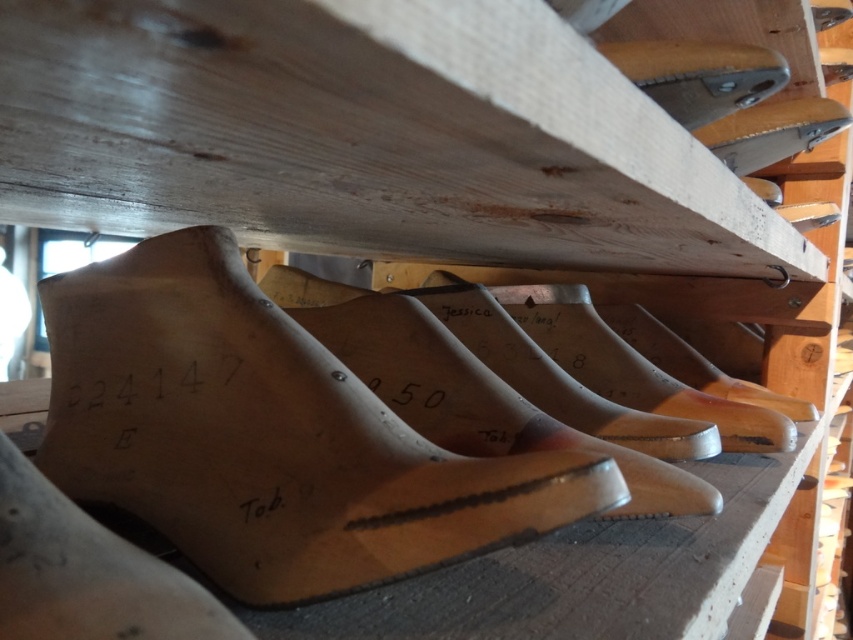
Who is more forward, (123,572) or (811,109)?

Point (123,572) is more forward.

Image resolution: width=853 pixels, height=640 pixels. What do you see at coordinates (86, 572) in the screenshot?
I see `light brown wood shoe at lower left` at bounding box center [86, 572].

Locate an element on the screen. Image resolution: width=853 pixels, height=640 pixels. light brown wood shoe at lower left is located at coordinates (86, 572).

Who is higher up, light brown wood shoe at lower left or wooden shoe at upper center?

wooden shoe at upper center

Who is positioned more to the right, light brown wood shoe at lower left or wooden shoe at upper center?

Positioned to the right is wooden shoe at upper center.

Is point (131, 616) farther from camera compared to point (659, 92)?

No, it is in front of (659, 92).

Locate an element on the screen. light brown wood shoe at lower left is located at coordinates (86, 572).

Who is taller, natural wood shoe at center or wooden shoe at upper right?

natural wood shoe at center

Does natural wood shoe at center have a greater height compared to wooden shoe at upper right?

Indeed, natural wood shoe at center has a greater height compared to wooden shoe at upper right.

What do you see at coordinates (267, 435) in the screenshot?
I see `natural wood shoe at center` at bounding box center [267, 435].

Where is `natural wood shoe at center`? The image size is (853, 640). natural wood shoe at center is located at coordinates (267, 435).